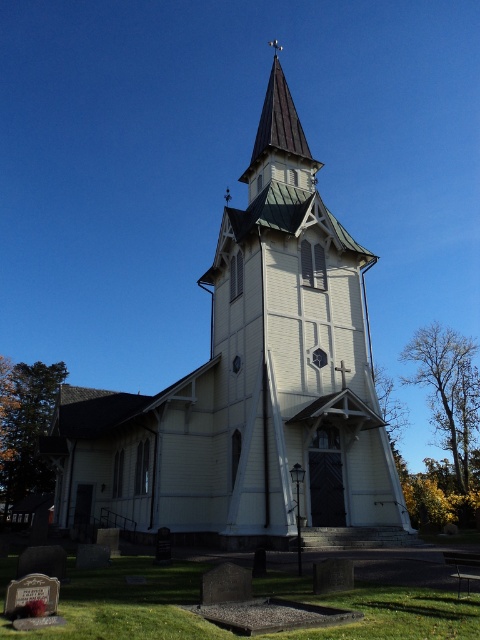
Can you confirm if white wood church at center is positioned below shiny copper spire at upper center?

Indeed, white wood church at center is positioned under shiny copper spire at upper center.

Can you confirm if white wood church at center is wider than shiny copper spire at upper center?

Correct, the width of white wood church at center exceeds that of shiny copper spire at upper center.

The width and height of the screenshot is (480, 640). I want to click on white wood church at center, so click(252, 387).